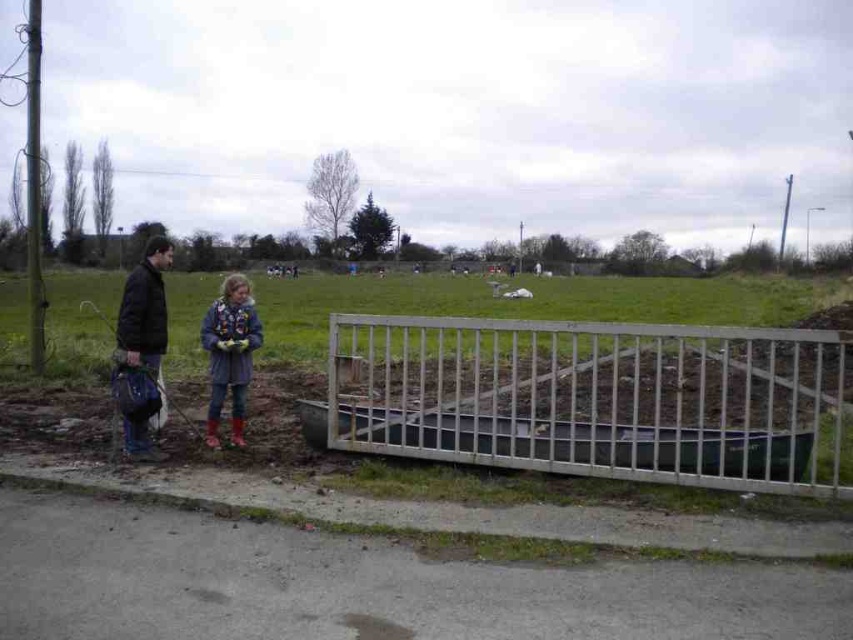
Measure the distance from dark brown leather jacket at left to denim jacket at center.

A distance of 3.83 feet exists between dark brown leather jacket at left and denim jacket at center.

Who is positioned more to the left, dark brown leather jacket at left or denim jacket at center?

dark brown leather jacket at left is more to the left.

Based on the photo, who is more forward, [146,344] or [227,355]?

Point [146,344] is more forward.

The height and width of the screenshot is (640, 853). In order to click on dark brown leather jacket at left in this screenshot , I will do coord(141,348).

Between silver metallic fence at center and denim jacket at center, which one has more height?

denim jacket at center is taller.

Can you confirm if silver metallic fence at center is wider than denim jacket at center?

Indeed, silver metallic fence at center has a greater width compared to denim jacket at center.

Where is `silver metallic fence at center`? silver metallic fence at center is located at coordinates (599, 397).

Locate an element on the screen. silver metallic fence at center is located at coordinates (599, 397).

Image resolution: width=853 pixels, height=640 pixels. What are the coordinates of `silver metallic fence at center` in the screenshot? It's located at (599, 397).